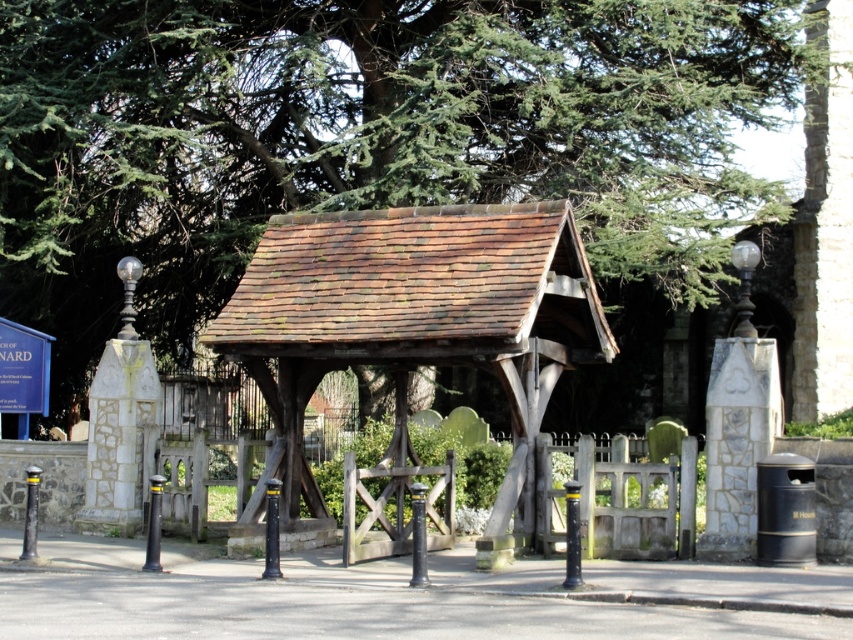
Between green leafy tree at upper center and rusty wood lychgate at center, which one has more height?

Standing taller between the two is green leafy tree at upper center.

Between green leafy tree at upper center and rusty wood lychgate at center, which one appears on the left side from the viewer's perspective?

From the viewer's perspective, rusty wood lychgate at center appears more on the left side.

Which is behind, point (195, 250) or point (258, 328)?

Positioned behind is point (195, 250).

Locate an element on the screen. green leafy tree at upper center is located at coordinates (367, 138).